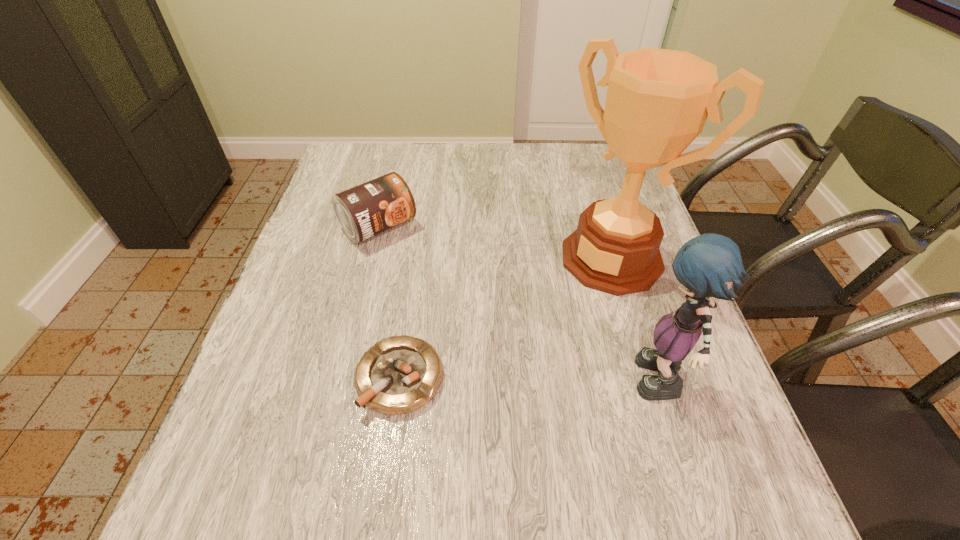
Find the location of a particular element. the shortest object is located at coordinates (400, 374).

The image size is (960, 540). Identify the location of rag doll. (709, 265).

The height and width of the screenshot is (540, 960). Identify the location of the second shortest object. (373, 207).

Locate an element on the screen. The width and height of the screenshot is (960, 540). the tallest object is located at coordinates (657, 102).

The width and height of the screenshot is (960, 540). I want to click on free space located 0.310m on the back of the shortest object, so click(x=420, y=242).

Where is `free space located 0.230m on the front-facing side of the rag doll`? This screenshot has height=540, width=960. free space located 0.230m on the front-facing side of the rag doll is located at coordinates (511, 387).

The image size is (960, 540). Identify the location of vacant space situated on the front-facing side of the rag doll. (432, 387).

At what (x,y) coordinates should I click in order to perform the action: click on free space located on the front-facing side of the rag doll. Please return your answer as a coordinate pair (x, y). Looking at the image, I should click on (421, 387).

You are a GUI agent. You are given a task and a screenshot of the screen. Output one action in this format:
    pyautogui.click(x=<x>, y=<y>)
    Task: Click on the free space located 0.100m on the front label of the can
    This screenshot has width=960, height=540.
    Given the screenshot: What is the action you would take?
    click(421, 269)

Locate an element on the screen. vacant space located on the front label of the can is located at coordinates (503, 350).